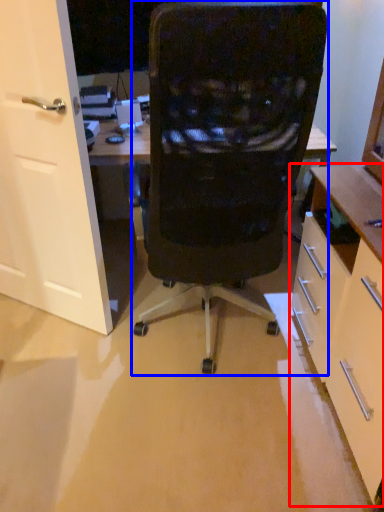
Question: Which object is closer to the camera taking this photo, cabinetry (highlighted by a red box) or chair (highlighted by a blue box)?

Choices:
 (A) cabinetry
 (B) chair

Answer: (A)